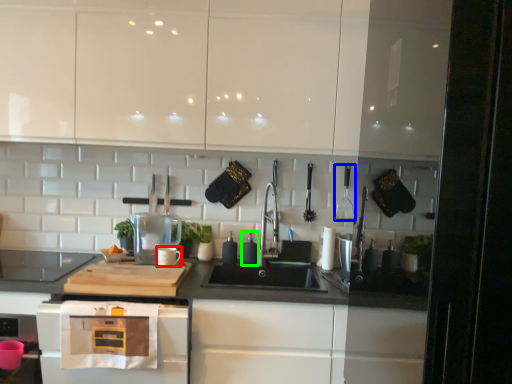
Question: Considering the real-world distances, which object is closest to appliance (highlighted by a red box)? appliance (highlighted by a blue box) or appliance (highlighted by a green box).

Choices:
 (A) appliance
 (B) appliance

Answer: (B)